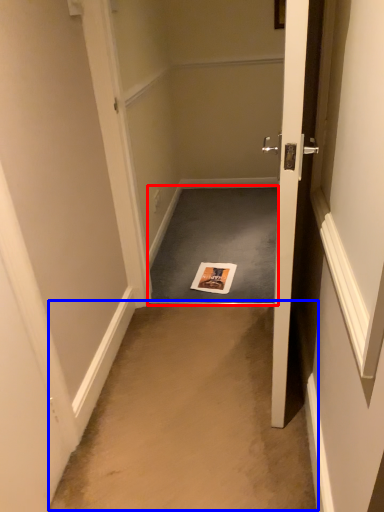
Question: Which of the following is the farthest to the observer, doormat (highlighted by a red box) or corridor (highlighted by a blue box)?

Choices:
 (A) doormat
 (B) corridor

Answer: (A)